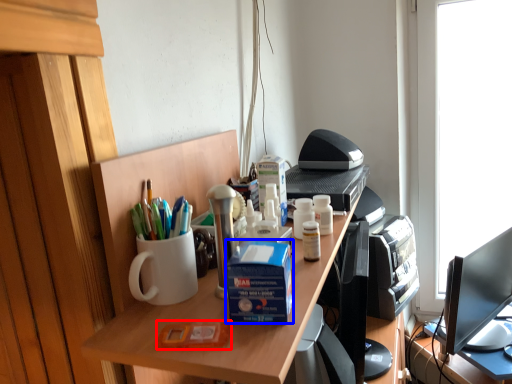
Question: Which point is closer to the camera, stationery (highlighted by a red box) or box (highlighted by a blue box)?

Choices:
 (A) stationery
 (B) box

Answer: (A)